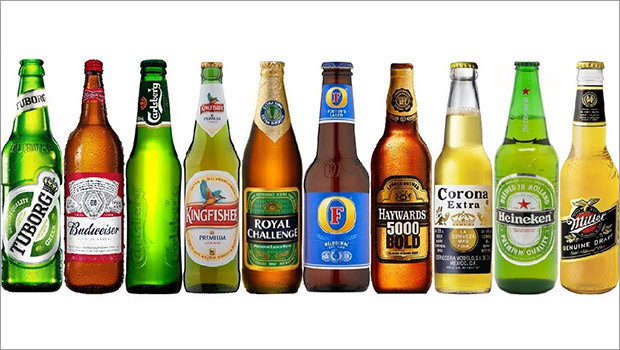
Locate an element on the screen. The image size is (620, 350). beer bottles with caps on the bottle is located at coordinates (20, 197), (69, 194), (149, 187), (213, 242), (255, 228), (337, 210), (401, 198), (454, 191), (505, 161).